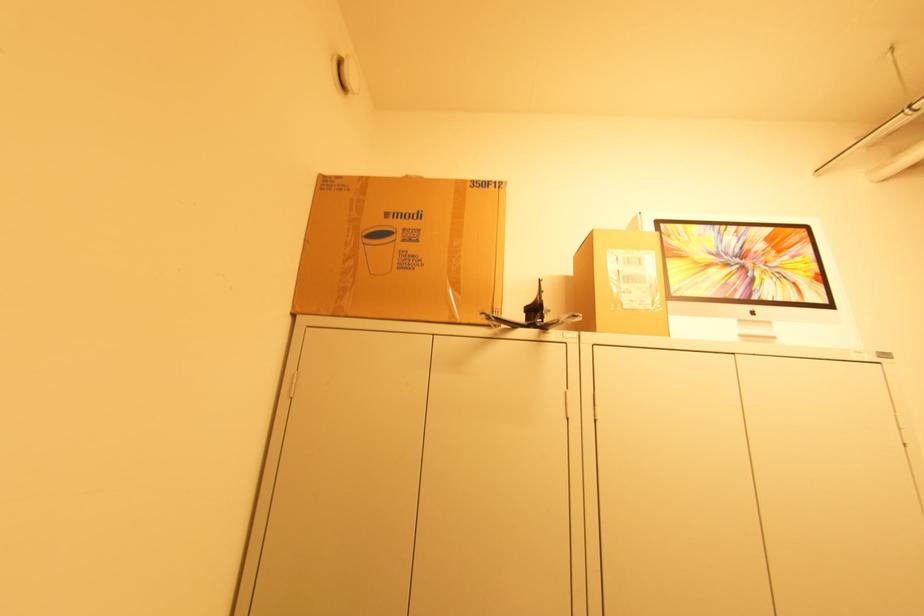
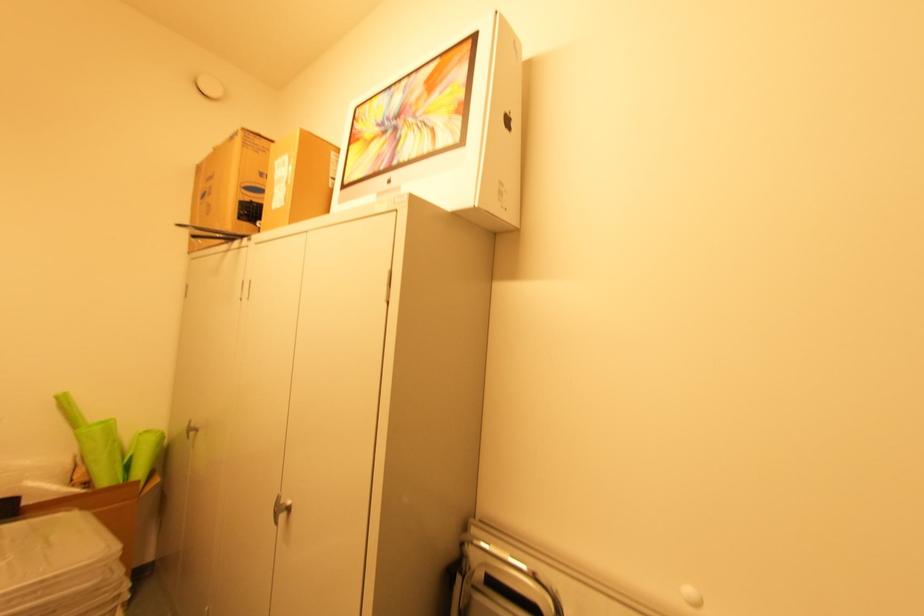
In the second image, find the point that corresponds to point 408,177 in the first image.

(216, 148)